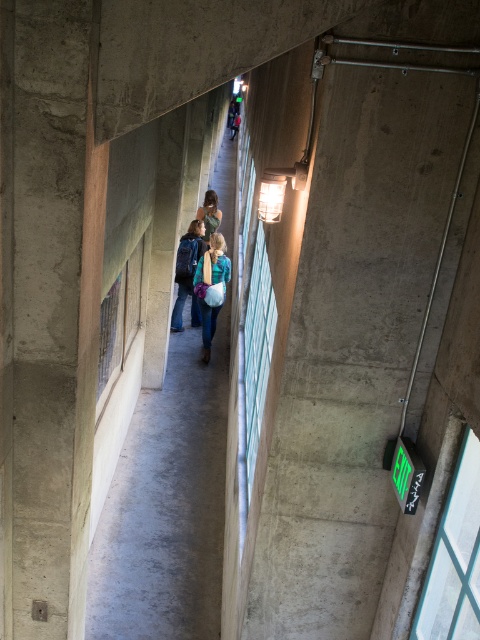
Question: Which point appears farthest from the camera in this image?

Choices:
 (A) (230, 180)
 (B) (205, 193)
 (C) (202, 282)
 (D) (183, 240)

Answer: (A)

Question: Is concrete wall at center bigger than matte black jacket at center?

Choices:
 (A) yes
 (B) no

Answer: (A)

Question: Which of the following is the farthest from the observer?

Choices:
 (A) (191, 260)
 (B) (207, 348)

Answer: (B)

Question: From the image, what is the correct spatial relationship of concrete wall at center in relation to denim jacket at center?

Choices:
 (A) left
 (B) right

Answer: (A)

Question: Can you confirm if concrete wall at center is positioned to the left of matte black jacket at center?

Choices:
 (A) no
 (B) yes

Answer: (A)

Question: Estimate the real-world distances between objects in this image. Which object is closer to the concrete wall at center?

Choices:
 (A) matte blue backpack at center
 (B) matte black jacket at center

Answer: (A)